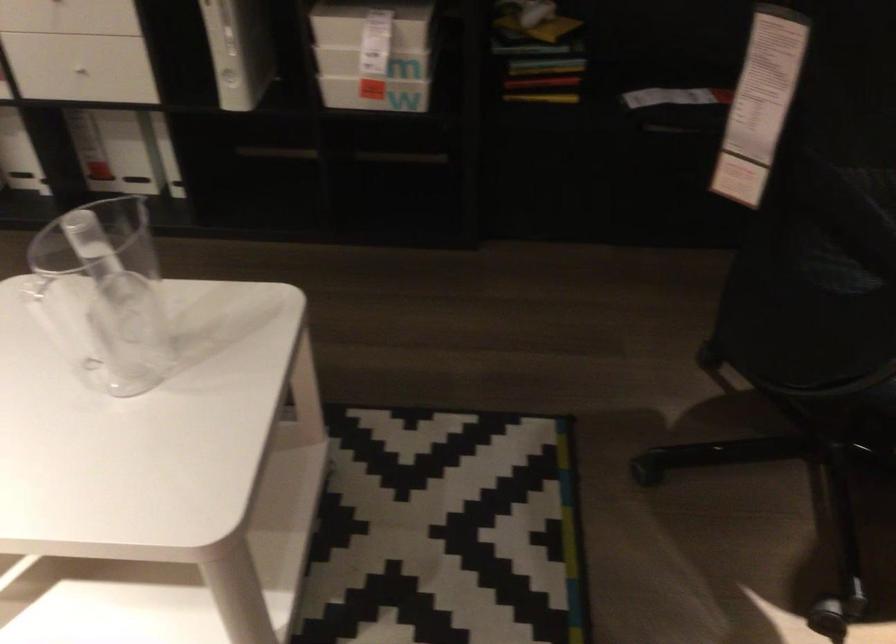
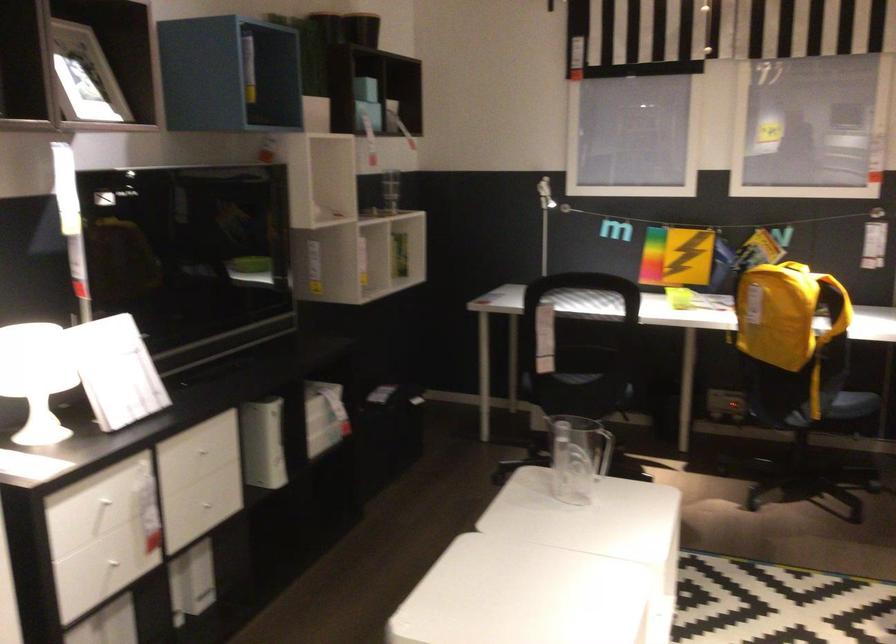
Locate, in the second image, the point that corresponds to (132,67) in the first image.

(209, 504)